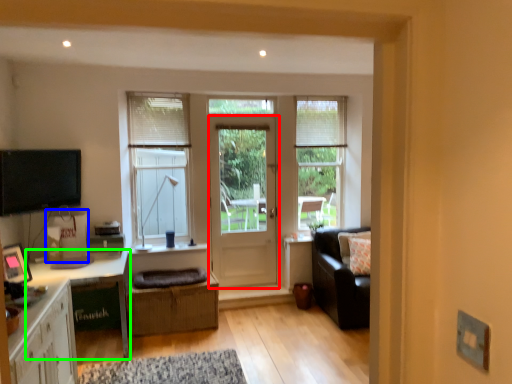
Question: Considering the real-world distances, which object is farthest from door (highlighted by a red box)? cardboard box (highlighted by a blue box) or desk (highlighted by a green box)?

Choices:
 (A) cardboard box
 (B) desk

Answer: (A)